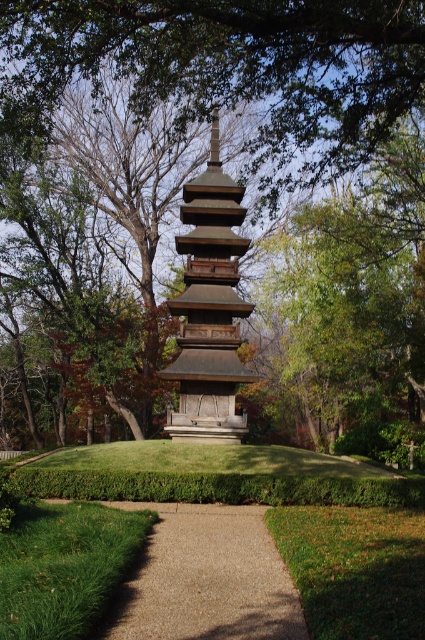
You are standing at the base of the green leafy tree at center in the garden. You want to take a photo of the pagoda using a camera that has a maximum zoom range of 10 meters. Can you capture the entire pagoda in your photo without moving closer? Please explain your reasoning.

The green leafy tree at center and camera are 12.83 meters apart from each other. Since the camera has a maximum zoom range of 10 meters, you cannot capture the entire pagoda in the photo without moving closer because the distance exceeds the camera capability.

You are a gardener planning to walk from the entrance to the brown wooden pagoda at center. The gravel path at center is the only path available. Based on the scene description, will you be able to reach the pagoda without stepping off the path?

The gravel path at center is shorter than the brown wooden pagoda at center, which means the path is not long enough to reach the pagoda. Therefore, you will need to step off the path to reach the pagoda.

You are a gardener planning to mow the grass around the green leafy tree at center and the gravel path at center. Which area requires a wider mowing path?

The green leafy tree at center requires a wider mowing path because its width surpasses that of the gravel path at center.